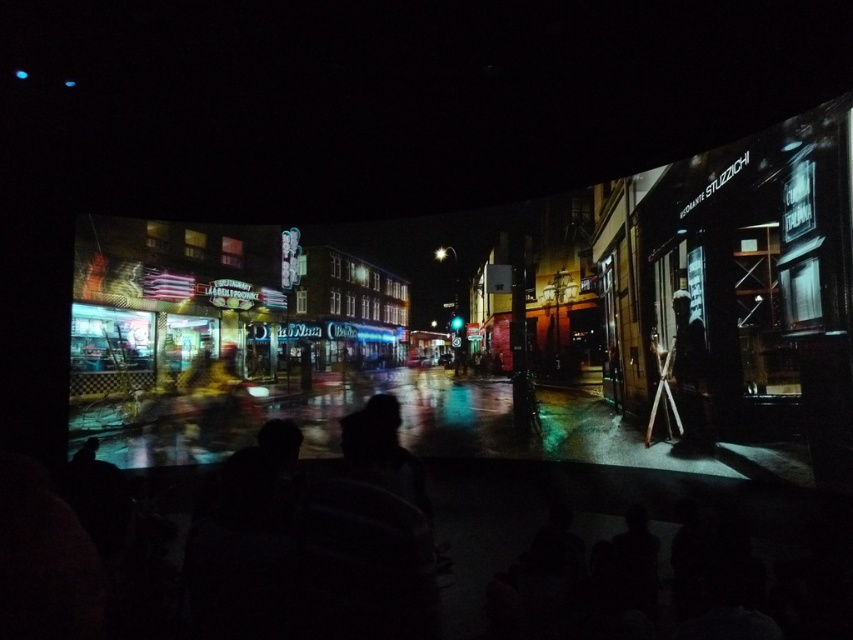
You are standing in a theater and want to get a closer look at the point marked at coordinates (521, 496) on the projection screen. The theater has a rule that you must stay at least 5 meters away from the screen to avoid disrupting the projection. Can you move closer to the point without breaking this rule?

The point marked at coordinates (521, 496) is 8.31 meters away from you. Since the theater requires staying at least 5 meters away, you can move closer but must not go beyond 5 meters. Therefore, you can approach to within 5 meters but cannot get closer than that.

You are an usher in a theater and need to guide a visually impaired attendee to the emergency exit. The attendee asks if there are any obstacles between them and the exit, which is located behind the dark textured figure at right. Based on the projection screen image, can you confirm if the black matte crowd at center is blocking the path to the exit?

The black matte crowd at center is in front of the dark textured figure at right, meaning the crowd is between the attendee and the exit. Therefore, the path to the exit is blocked by the black matte crowd at center.